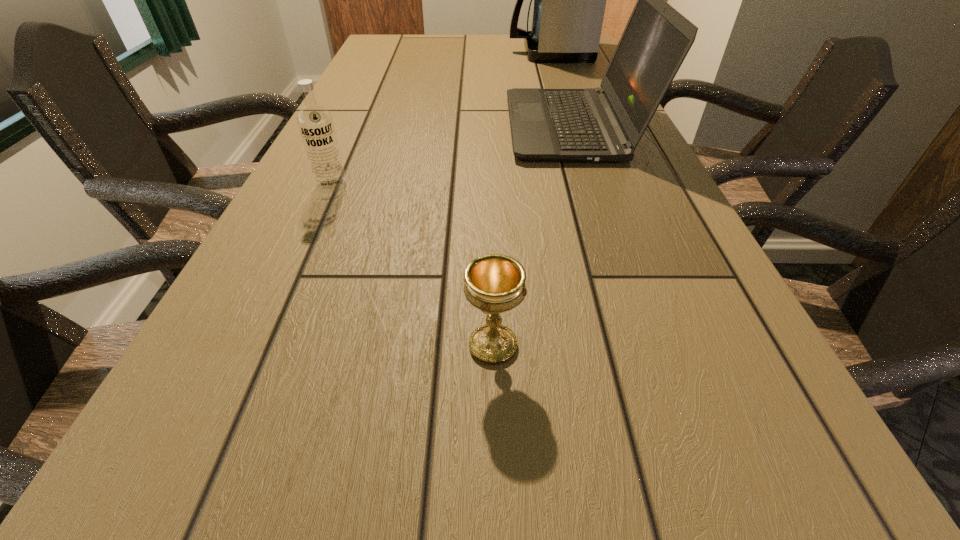
This screenshot has width=960, height=540. Find the location of `free space between the leftmost object and the chalice`. free space between the leftmost object and the chalice is located at coordinates (413, 266).

Find the location of a particular element. This screenshot has height=540, width=960. vacant space that's between the third object from right to left and the coffee maker is located at coordinates (521, 199).

Select which object appears as the closest to the laptop_computer. Please provide its 2D coordinates. Your answer should be formatted as a tuple, i.e. [(x, y)], where the tuple contains the x and y coordinates of a point satisfying the conditions above.

[(569, 0)]

Locate which object ranks third in proximity to the farthest object. Please provide its 2D coordinates. Your answer should be formatted as a tuple, i.e. [(x, y)], where the tuple contains the x and y coordinates of a point satisfying the conditions above.

[(494, 283)]

Where is `vacant area in the image that satisfies the following two spatial constraints: 1. on the front label of the shortest object; 2. on the left side of the third farthest object`? vacant area in the image that satisfies the following two spatial constraints: 1. on the front label of the shortest object; 2. on the left side of the third farthest object is located at coordinates (261, 346).

This screenshot has width=960, height=540. In order to click on free location that satisfies the following two spatial constraints: 1. on the screen of the third nearest object; 2. on the front label of the leftmost object in this screenshot , I will do `click(593, 186)`.

You are a GUI agent. You are given a task and a screenshot of the screen. Output one action in this format:
    pyautogui.click(x=<x>, y=<y>)
    Task: Click on the free location that satisfies the following two spatial constraints: 1. on the screen of the laptop_computer; 2. on the front label of the second shortest object
    
    Given the screenshot: What is the action you would take?
    pyautogui.click(x=593, y=186)

Identify the location of vacant space that satisfies the following two spatial constraints: 1. on the screen of the third shortest object; 2. on the front side of the nearest object. This screenshot has height=540, width=960. coord(648,346).

Image resolution: width=960 pixels, height=540 pixels. I want to click on free space that satisfies the following two spatial constraints: 1. on the screen of the second tallest object; 2. on the front label of the third tallest object, so click(593, 186).

Where is `vacant region that satisfies the following two spatial constraints: 1. on the front panel of the farthest object; 2. on the front label of the third farthest object`? Image resolution: width=960 pixels, height=540 pixels. vacant region that satisfies the following two spatial constraints: 1. on the front panel of the farthest object; 2. on the front label of the third farthest object is located at coordinates tap(595, 186).